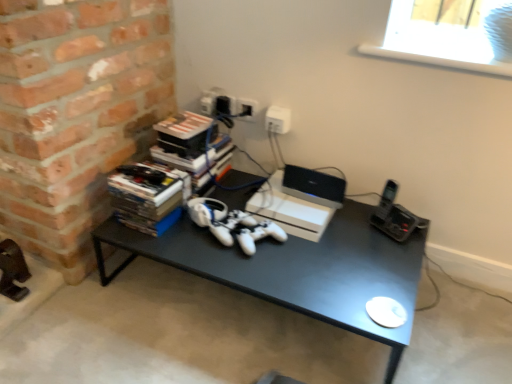
The height and width of the screenshot is (384, 512). I want to click on free spot to the right of white matte gaming console at center, so click(361, 225).